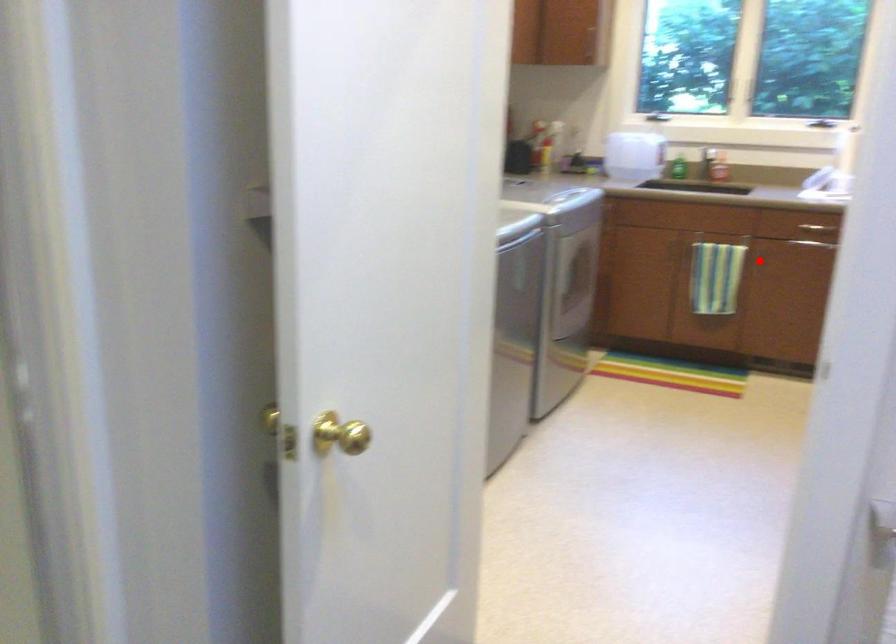
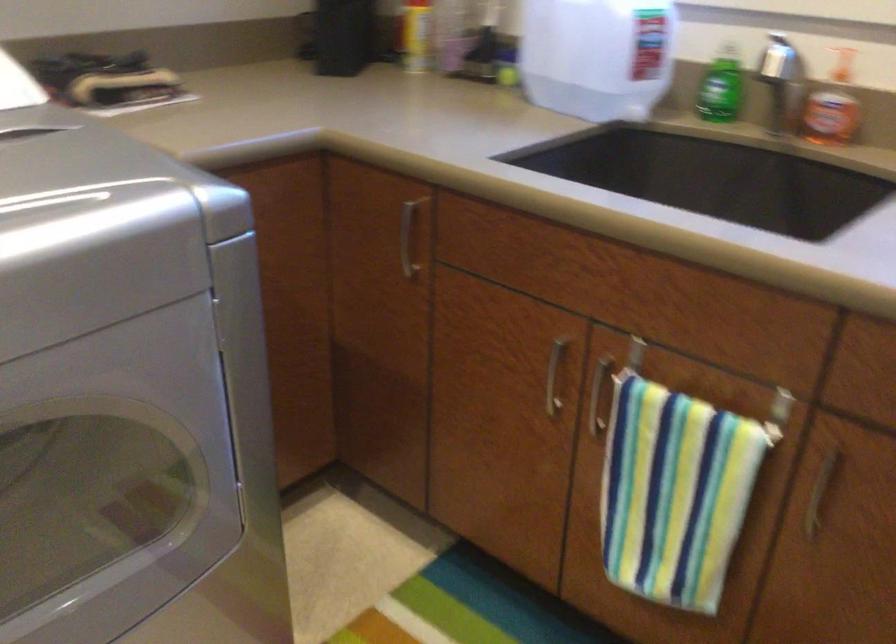
Question: I am providing you with two images of the same scene from different viewpoints. A red point is marked on the first image. At the location where the point appears in image 1, is it still visible in image 2?

Choices:
 (A) Yes
 (B) No

Answer: (A)